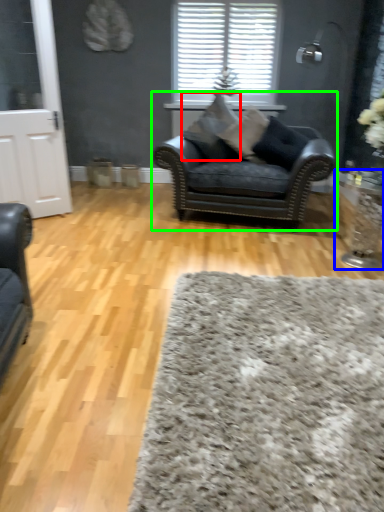
Question: Which object is positioned closest to pillow (highlighted by a red box)? Select from side table (highlighted by a blue box) and chair (highlighted by a green box).

Choices:
 (A) side table
 (B) chair

Answer: (B)